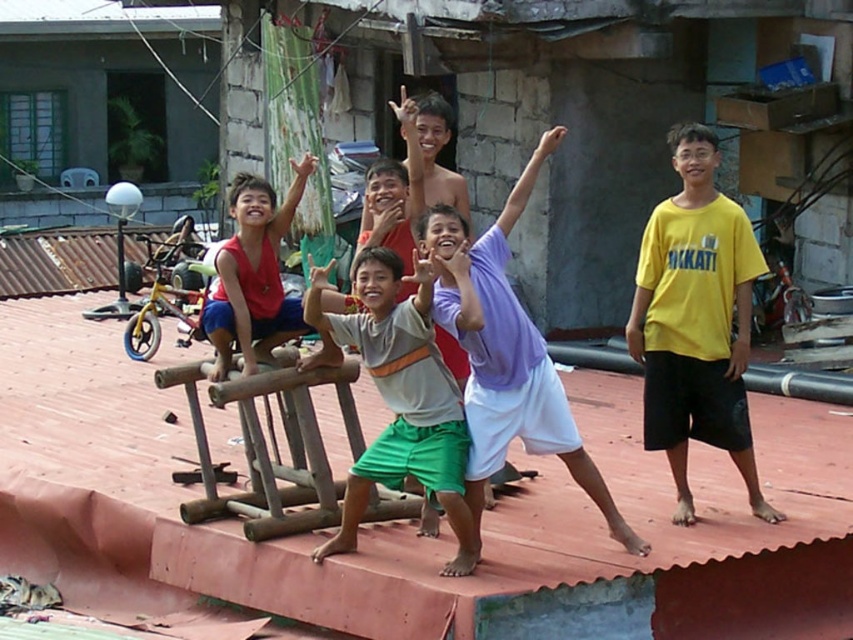
Question: Is purple cotton shirt at center above green cotton shorts at center?

Choices:
 (A) no
 (B) yes

Answer: (B)

Question: Which is farther from the yellow cotton shirt at right?

Choices:
 (A) green cotton shorts at center
 (B) matte red tank top at center
 (C) purple cotton shirt at center

Answer: (B)

Question: Which object is positioned farthest from the green cotton shorts at center?

Choices:
 (A) matte red tank top at center
 (B) purple cotton shirt at center
 (C) yellow cotton shirt at right

Answer: (C)

Question: Can you confirm if yellow cotton shirt at right is positioned below matte red tank top at center?

Choices:
 (A) yes
 (B) no

Answer: (A)

Question: Which point appears closest to the camera in this image?

Choices:
 (A) (289, 301)
 (B) (480, 236)
 (C) (660, 259)
 (D) (445, 458)

Answer: (D)

Question: Is purple cotton shirt at center to the left of green cotton shorts at center from the viewer's perspective?

Choices:
 (A) no
 (B) yes

Answer: (A)